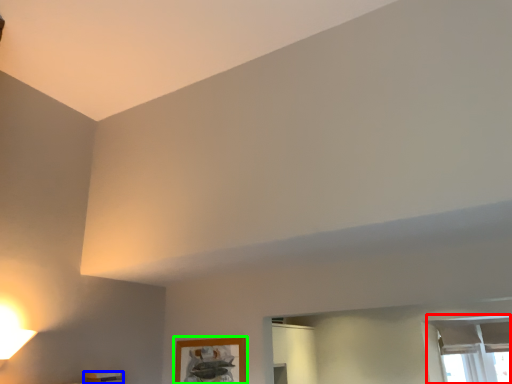
Question: Which object is the closest to the window (highlighted by a red box)? Choose among these: furniture (highlighted by a blue box) or picture frame (highlighted by a green box).

Choices:
 (A) furniture
 (B) picture frame

Answer: (B)